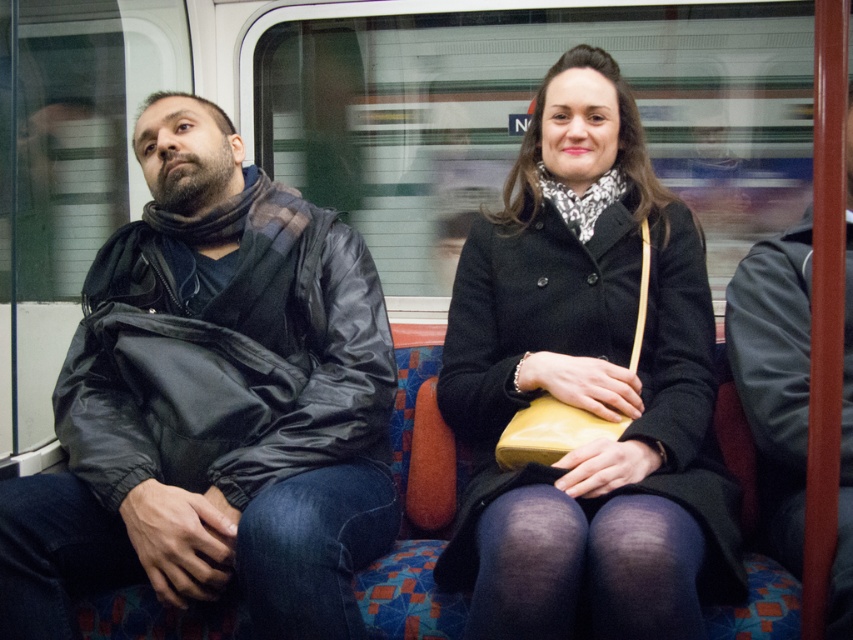
You are a fashion designer observing two jackets in a photo of a train scene. The jackets belong to a man and a woman. The man is wearing a matte black jacket at left, and the woman is wearing a leather jacket at right. Which jacket is bigger in size?

The matte black jacket at left is larger in size compared to the leather jacket at right.

You are a passenger on a crowded train and need to retrieve your bag from under the seat. The black matte coat at center and the leather jacket at right are in your way. Which item is closer to you so you can move it first?

The black matte coat at center is positioned over the leather jacket at right, meaning it is closer to you. Move the black matte coat at center first to access your bag.

You are a passenger on a moving train and want to know which piece of clothing is closer to you between the matte black jacket at left and the black matte coat at center. Which one is closer?

The matte black jacket at left is closer to you because it is positioned further to the viewer than the black matte coat at center.